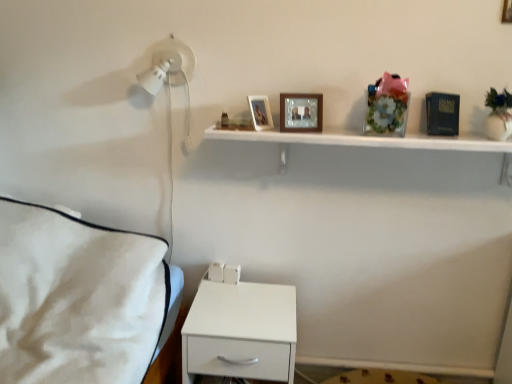
At what (x,y) coordinates should I click in order to perform the action: click on free point to the right of matte wooden picture frame at upper center, which appears as the third picture frame when viewed from the right. Please return your answer as a coordinate pair (x, y). Looking at the image, I should click on (296, 131).